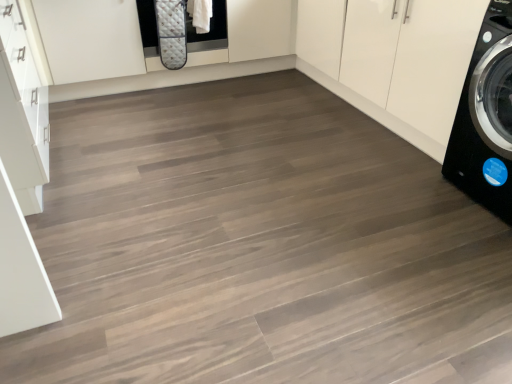
Question: From the image's perspective, relative to black glossy washing machine at right, is white glossy cabinet at upper right above or below?

Choices:
 (A) below
 (B) above

Answer: (B)

Question: Based on their sizes in the image, would you say white glossy cabinet at upper right is bigger or smaller than black glossy washing machine at right?

Choices:
 (A) big
 (B) small

Answer: (A)

Question: Does point (353, 94) appear closer or farther from the camera than point (488, 100)?

Choices:
 (A) farther
 (B) closer

Answer: (A)

Question: Relative to white glossy cabinet at upper right, is black glossy washing machine at right in front or behind?

Choices:
 (A) behind
 (B) front

Answer: (B)

Question: In the image, is black glossy washing machine at right on the left side or the right side of white glossy cabinet at upper right?

Choices:
 (A) right
 (B) left

Answer: (A)

Question: Looking at the image, does black glossy washing machine at right seem bigger or smaller compared to white glossy cabinet at upper right?

Choices:
 (A) big
 (B) small

Answer: (B)

Question: Is black glossy washing machine at right wider or thinner than white glossy cabinet at upper right?

Choices:
 (A) wide
 (B) thin

Answer: (B)